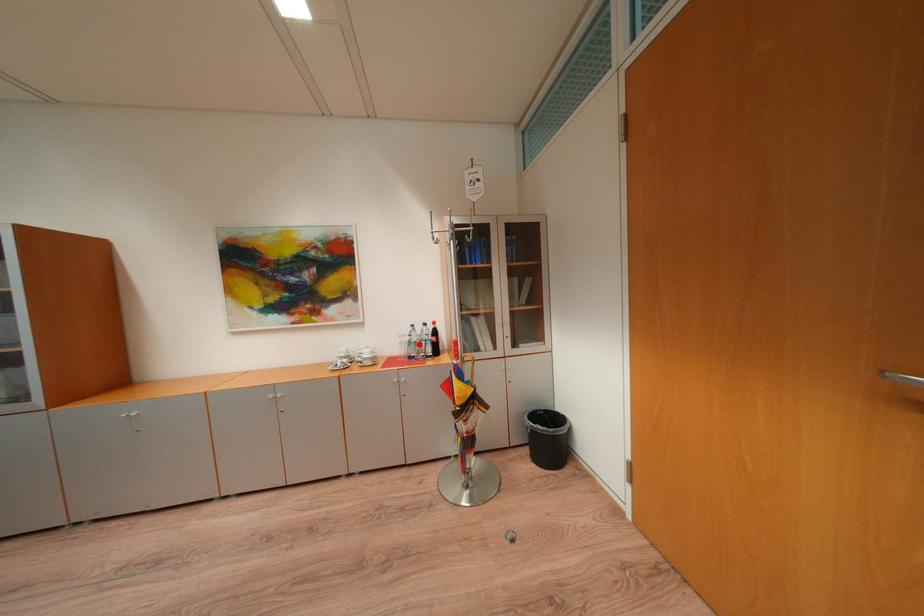
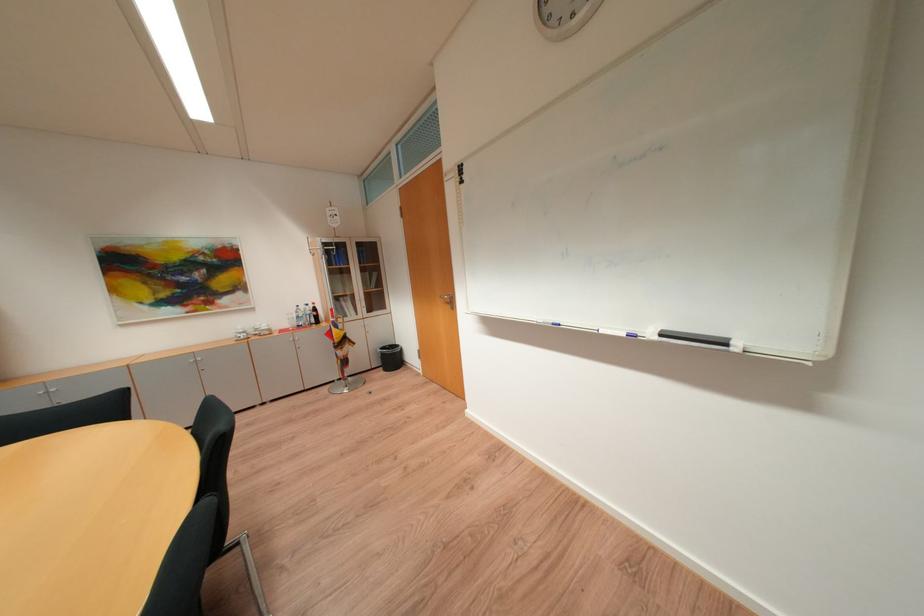
Find the pixel in the second image that matches the highlighted location in the first image.

(307, 318)